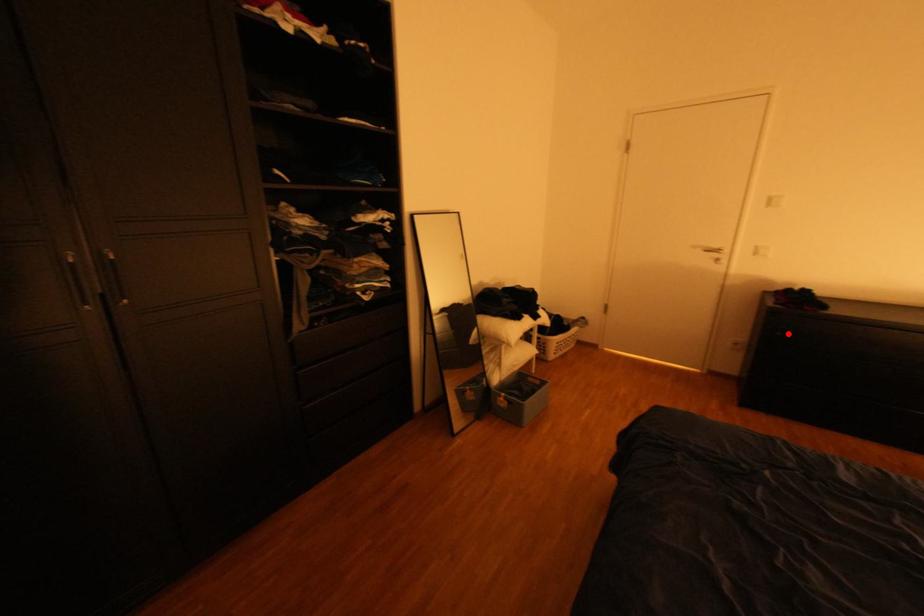
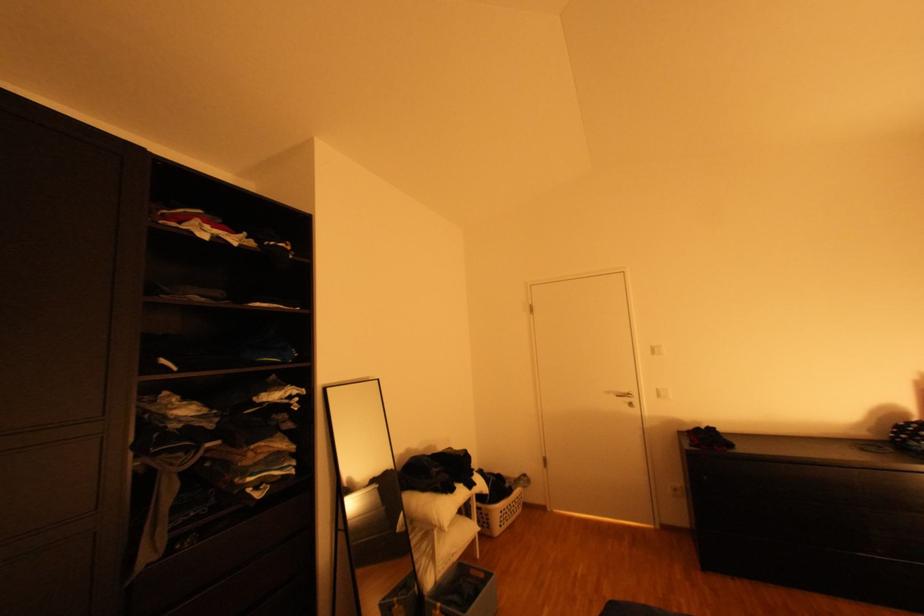
Locate, in the second image, the point that corresponds to the highlighted location in the first image.

(715, 477)